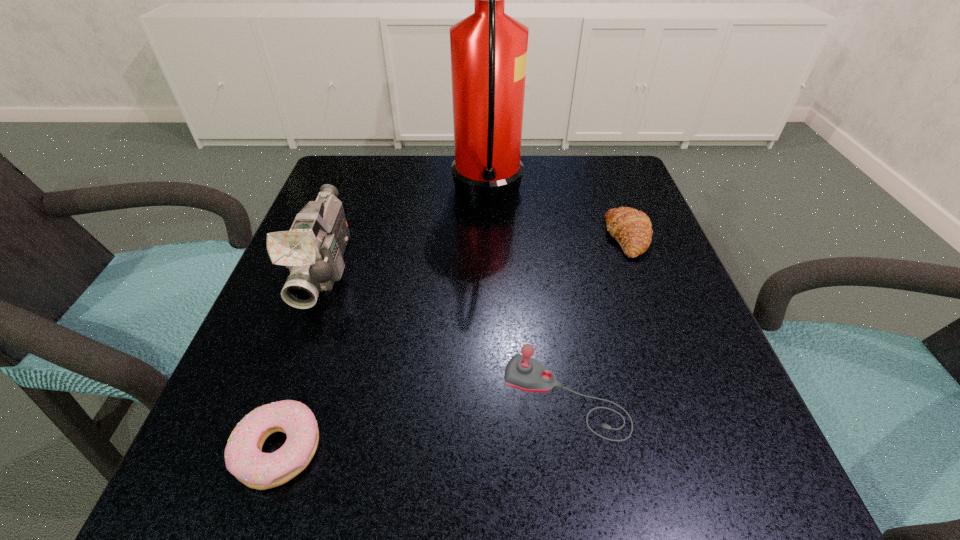
Find the location of a particular element. The width and height of the screenshot is (960, 540). vacant space in between the joystick and the shortest object is located at coordinates (421, 423).

This screenshot has height=540, width=960. Find the location of `vacant space that is in between the second tallest object and the shortest object`. vacant space that is in between the second tallest object and the shortest object is located at coordinates (302, 359).

The image size is (960, 540). In order to click on unoccupied position between the shortest object and the third shortest object in this screenshot , I will do `click(421, 423)`.

At what (x,y) coordinates should I click in order to perform the action: click on vacant area that lies between the tallest object and the doughnut. Please return your answer as a coordinate pair (x, y). The height and width of the screenshot is (540, 960). Looking at the image, I should click on (383, 323).

Where is `vacant point located between the shortest object and the joystick`? This screenshot has height=540, width=960. vacant point located between the shortest object and the joystick is located at coordinates (421, 423).

Identify the location of vacant region between the third shortest object and the fire extinguisher. This screenshot has width=960, height=540. (526, 298).

Locate which object is the second closest to the second tallest object. Please provide its 2D coordinates. Your answer should be formatted as a tuple, i.e. [(x, y)], where the tuple contains the x and y coordinates of a point satisfying the conditions above.

[(244, 459)]

The height and width of the screenshot is (540, 960). I want to click on object that stands as the fourth closest to the fire extinguisher, so click(244, 459).

At what (x,y) coordinates should I click in order to perform the action: click on vacant space that satisfies the following two spatial constraints: 1. at the spray nozzle of the tallest object; 2. on the front-facing side of the second tallest object. Please return your answer as a coordinate pair (x, y). This screenshot has width=960, height=540. Looking at the image, I should click on (489, 269).

The width and height of the screenshot is (960, 540). In order to click on vacant space that satisfies the following two spatial constraints: 1. on the front-facing side of the joystick; 2. on the left side of the fourth shortest object in this screenshot , I will do `click(279, 397)`.